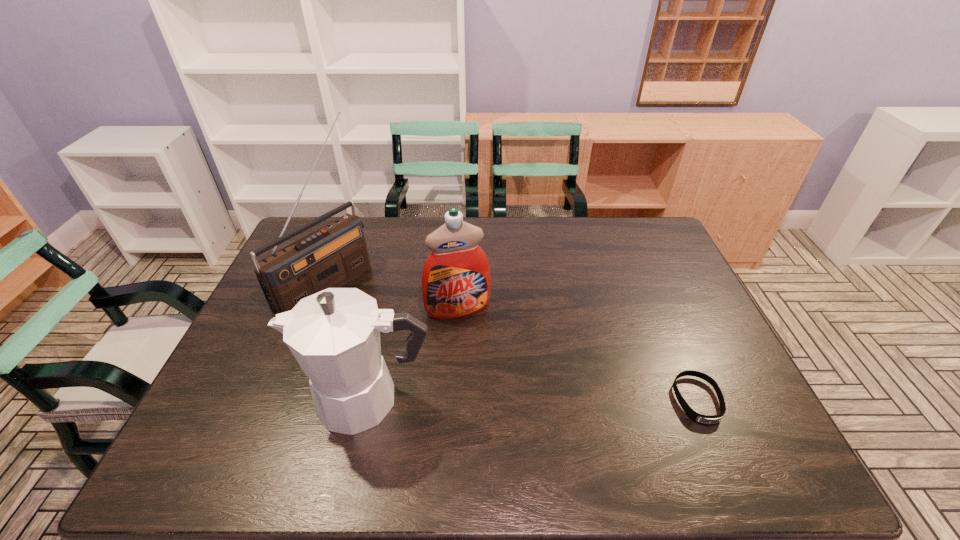
Identify the location of vacant position located 0.210m on the front-facing side of the tallest object. click(x=399, y=338).

Locate an element on the screen. vacant area located 0.080m on the front surface of the detergent is located at coordinates (473, 341).

Where is `blank area located 0.220m on the front surface of the detergent`? The width and height of the screenshot is (960, 540). blank area located 0.220m on the front surface of the detergent is located at coordinates (488, 382).

Where is `vacant region located 0.260m on the front surface of the detergent`? vacant region located 0.260m on the front surface of the detergent is located at coordinates (492, 396).

Locate an element on the screen. The height and width of the screenshot is (540, 960). object that is at the far edge is located at coordinates (331, 256).

Locate an element on the screen. coffeepot present at the near edge is located at coordinates (334, 335).

The image size is (960, 540). In order to click on wristband situated at the near edge in this screenshot , I will do `click(699, 418)`.

Where is `object that is at the left edge`? This screenshot has width=960, height=540. object that is at the left edge is located at coordinates (331, 256).

Locate an element on the screen. object located at the right edge is located at coordinates (699, 418).

What are the coordinates of `object that is positioned at the far left corner` in the screenshot? It's located at (331, 256).